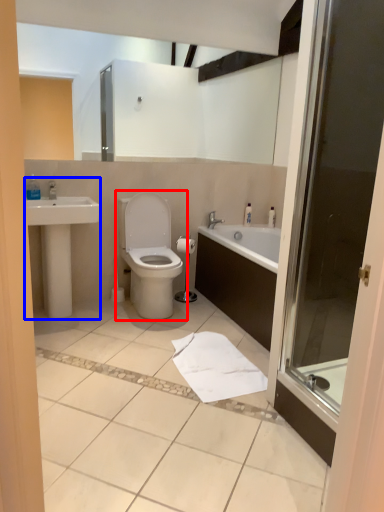
Question: Which object is closer to the camera taking this photo, toilet (highlighted by a red box) or sink (highlighted by a blue box)?

Choices:
 (A) toilet
 (B) sink

Answer: (B)